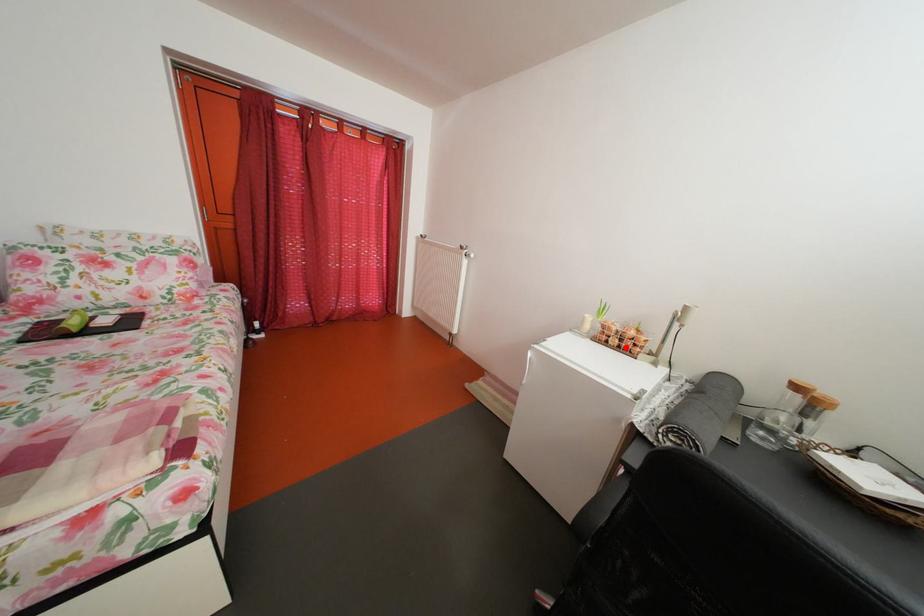
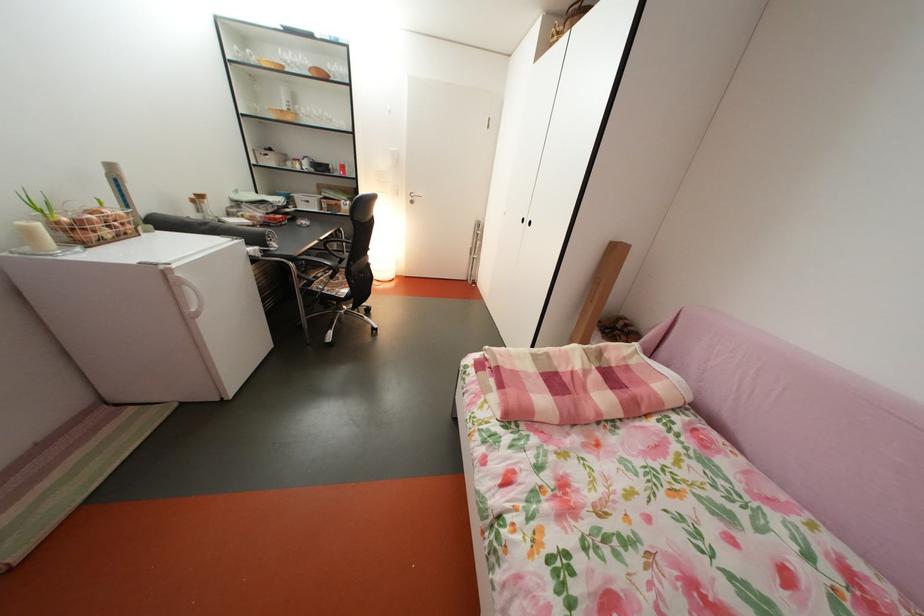
Locate, in the second image, the point that corresponds to the highlighted location in the first image.

(118, 238)